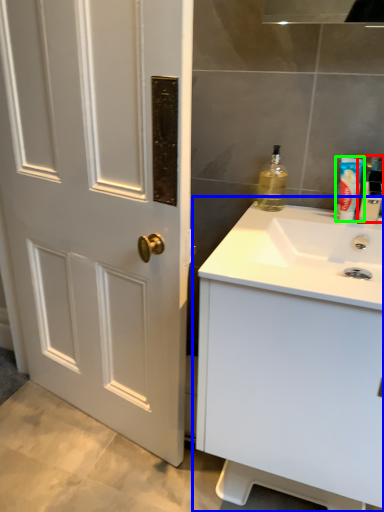
Question: Which object is the closest to the bottle (highlighted by a red box)? Choose among these: bathroom cabinet (highlighted by a blue box) or mouthwash (highlighted by a green box).

Choices:
 (A) bathroom cabinet
 (B) mouthwash

Answer: (B)